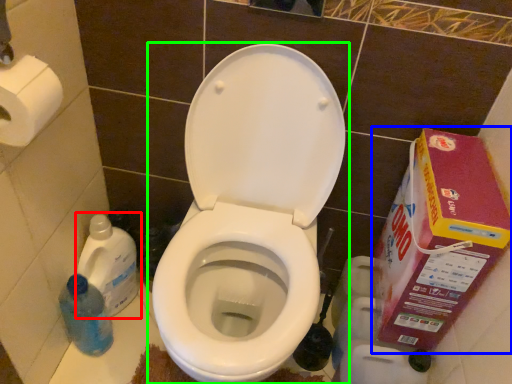
Question: Which object is positioned farthest from cleaning product (highlighted by a red box)? Select from cardboard box (highlighted by a blue box) and toilet (highlighted by a green box).

Choices:
 (A) cardboard box
 (B) toilet

Answer: (A)